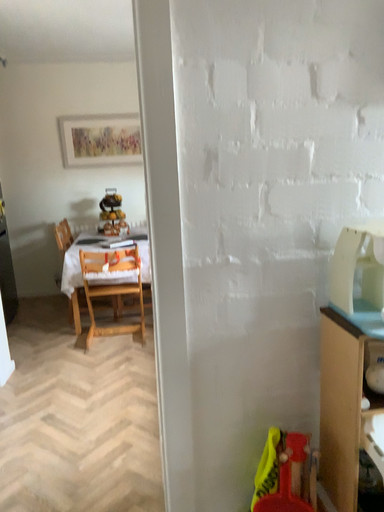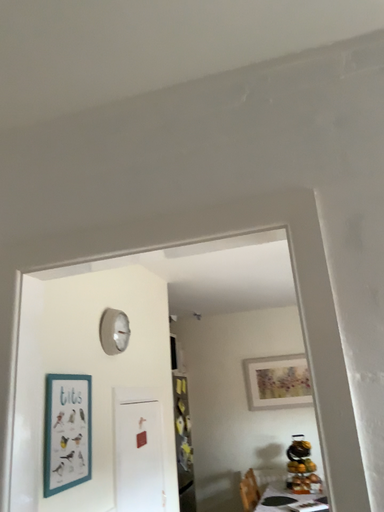
Question: How did the camera likely rotate when shooting the video?

Choices:
 (A) rotated left
 (B) rotated right

Answer: (A)